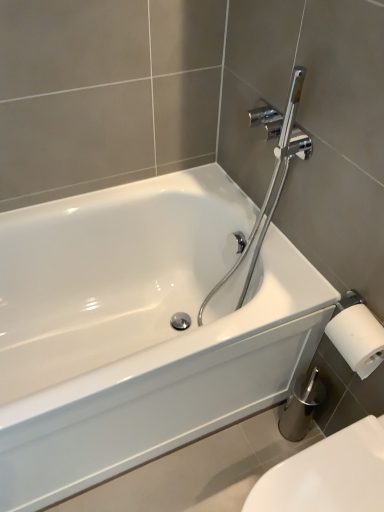
Where is `free space above white glossy toilet at lower right (from a real-world perspective)`? free space above white glossy toilet at lower right (from a real-world perspective) is located at coordinates (331, 475).